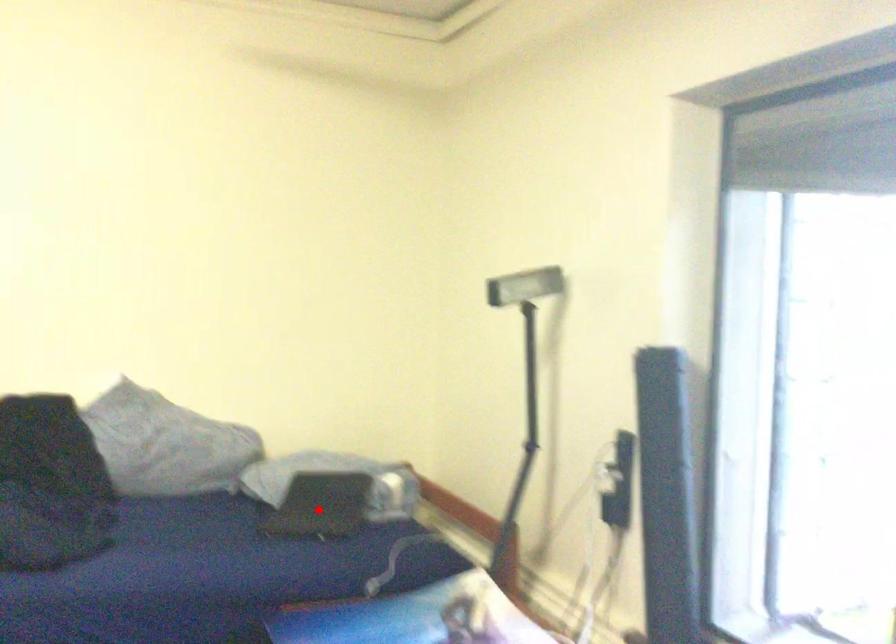
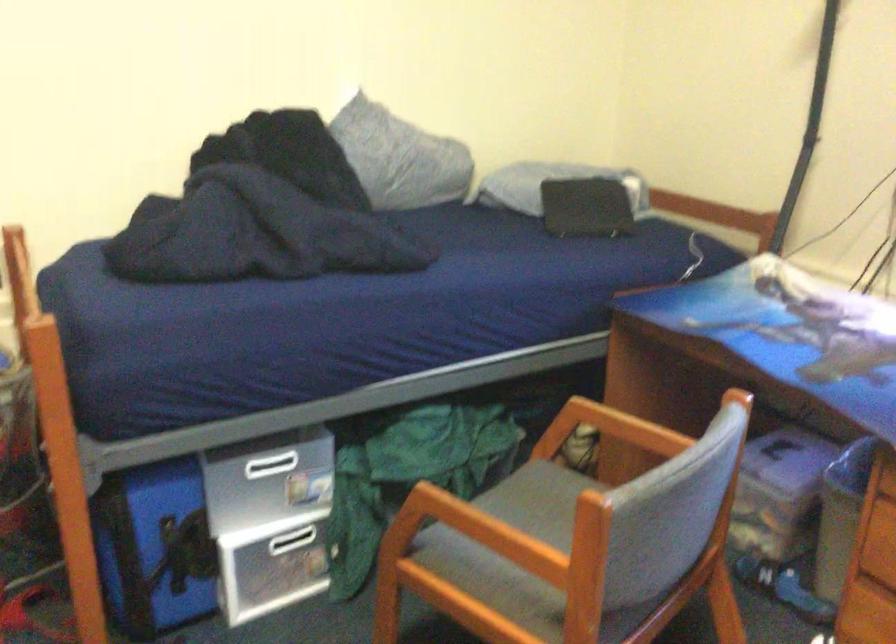
In the second image, find the point that corresponds to the highlighted location in the first image.

(586, 207)